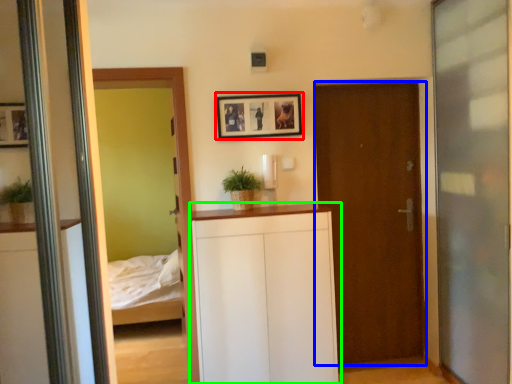
Question: Estimate the real-world distances between objects in this image. Which object is closer to picture frame (highlighted by a red box), door (highlighted by a blue box) or dresser (highlighted by a green box)?

Choices:
 (A) door
 (B) dresser

Answer: (A)